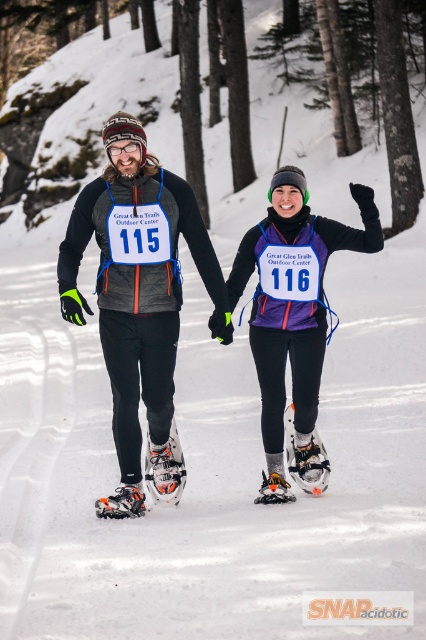
Question: Is white plastic snowshoe at center bigger than white plastic snowshoe at lower left?

Choices:
 (A) no
 (B) yes

Answer: (B)

Question: Is white mesh snowshoe at lower center above white plastic snowshoe at lower left?

Choices:
 (A) yes
 (B) no

Answer: (A)

Question: Which object is the farthest from the purple matte snowshoe at center?

Choices:
 (A) transparent plastic goggles at upper center
 (B) orange plastic snowshoe at lower center
 (C) white mesh snowshoe at lower center
 (D) white plastic snowshoe at center

Answer: (A)

Question: Which object is farther from the camera taking this photo?

Choices:
 (A) white mesh snowshoe at lower center
 (B) purple matte snowshoe at center
 (C) orange plastic snowshoe at lower center
 (D) matte black snowshoes at center

Answer: (C)

Question: Does white mesh snowshoe at lower center have a smaller size compared to white plastic snowshoe at center?

Choices:
 (A) yes
 (B) no

Answer: (A)

Question: Which point appears closest to the camera in this image?

Choices:
 (A) (281, 493)
 (B) (120, 490)
 (C) (112, 148)
 (D) (307, 481)

Answer: (C)